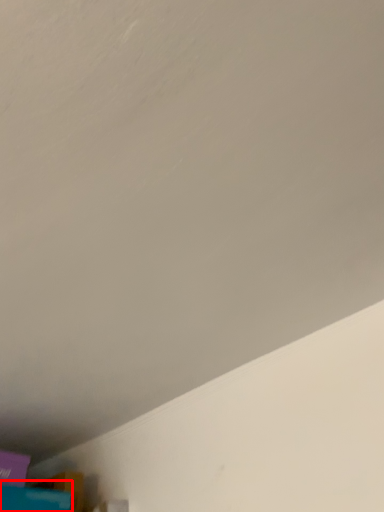
Question: From the image's perspective, considering the relative positions of wide (annotated by the red box) and box in the image provided, where is wide (annotated by the red box) located with respect to the staircase?

Choices:
 (A) below
 (B) above

Answer: (A)